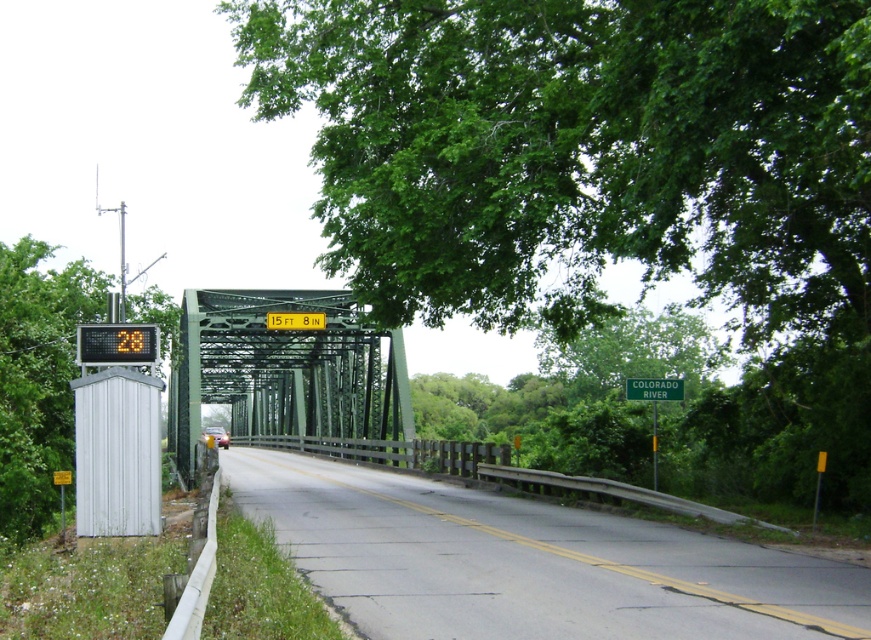
Between point (710, 557) and point (142, 346), which one is positioned in front?

Point (710, 557) is in front.

Between asphalt road at center and orange digital sign at left, which one is positioned lower?

asphalt road at center

Describe the element at coordinates (528, 563) in the screenshot. I see `asphalt road at center` at that location.

Find the location of a particular element. The width and height of the screenshot is (871, 640). asphalt road at center is located at coordinates pyautogui.click(x=528, y=563).

Can you confirm if green leafy tree at center is positioned to the left of green leafy tree at left?

No, green leafy tree at center is not to the left of green leafy tree at left.

Does green leafy tree at center have a lesser height compared to green leafy tree at left?

In fact, green leafy tree at center may be taller than green leafy tree at left.

The width and height of the screenshot is (871, 640). What do you see at coordinates (606, 180) in the screenshot?
I see `green leafy tree at center` at bounding box center [606, 180].

The image size is (871, 640). Identify the location of green leafy tree at center. (606, 180).

Which is above, asphalt road at center or green leafy tree at left?

green leafy tree at left is above.

How much distance is there between asphalt road at center and green leafy tree at left?

asphalt road at center is 23.29 feet from green leafy tree at left.

Measure the distance between point (308,568) and camera.

11.54 meters

Where is `asphalt road at center`? Image resolution: width=871 pixels, height=640 pixels. asphalt road at center is located at coordinates (528, 563).